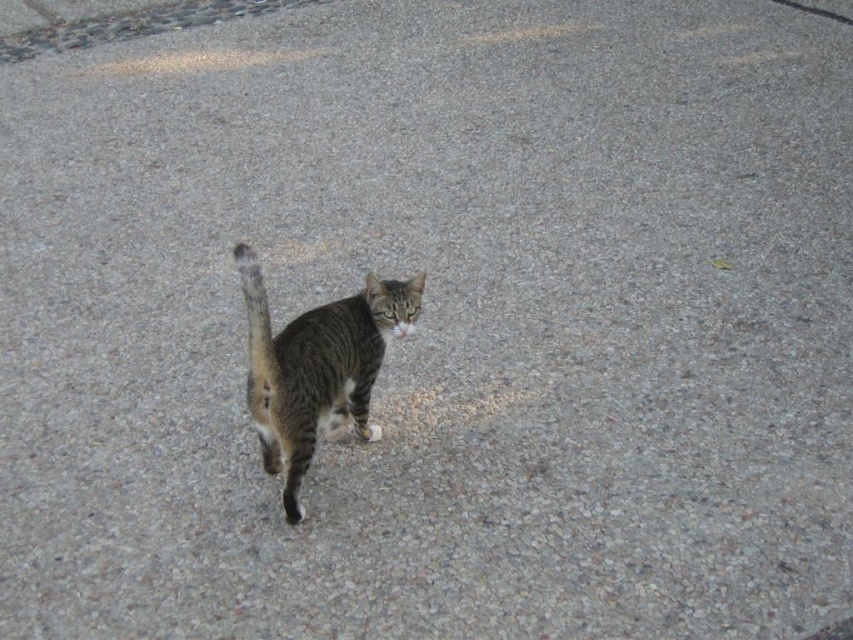
Can you confirm if striped fur cat at center is thinner than striped fur tail at center?

No.

Based on the photo, between striped fur cat at center and striped fur tail at center, which one is positioned lower?

striped fur cat at center

This screenshot has height=640, width=853. I want to click on striped fur cat at center, so click(x=317, y=365).